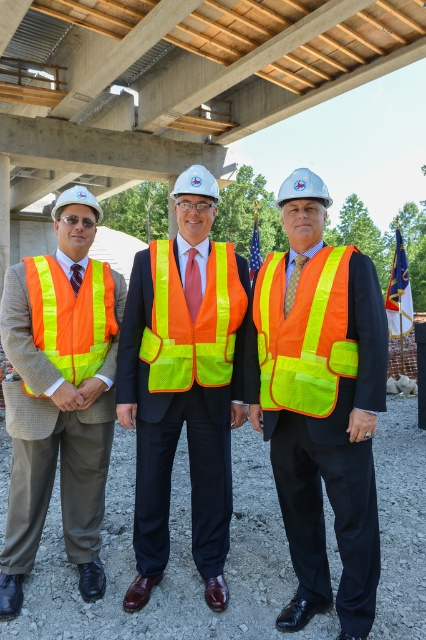
Can you confirm if matte orange safety vest at center is thinner than high-visibility reflective safety vest at left?

No.

The image size is (426, 640). What are the coordinates of `matte orange safety vest at center` in the screenshot? It's located at (60, 396).

Which is in front, point (275, 317) or point (213, 333)?

Positioned in front is point (275, 317).

Can you confirm if neon yellow reflective safety vest at center is smaller than high-visibility reflective safety vest at center?

Yes, neon yellow reflective safety vest at center is smaller than high-visibility reflective safety vest at center.

Is point (316, 326) positioned behind point (195, 336)?

No, (316, 326) is in front of (195, 336).

I want to click on neon yellow reflective safety vest at center, so click(304, 333).

Is high-visibility reflective vest at center in front of neon yellow reflective safety vest at center?

No, high-visibility reflective vest at center is behind neon yellow reflective safety vest at center.

Where is `high-visibility reflective vest at center`? This screenshot has width=426, height=640. high-visibility reflective vest at center is located at coordinates (183, 385).